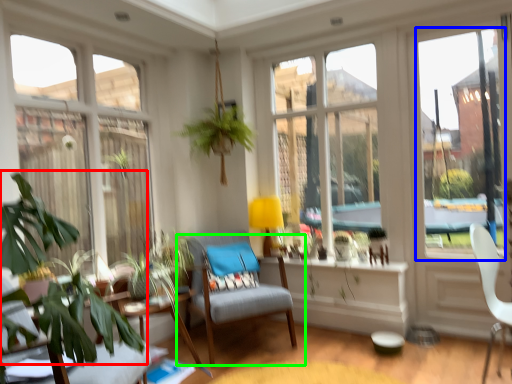
Question: Estimate the real-world distances between objects in this image. Which object is closer to plant (highlighted by a red box), window screen (highlighted by a blue box) or chair (highlighted by a green box)?

Choices:
 (A) window screen
 (B) chair

Answer: (B)